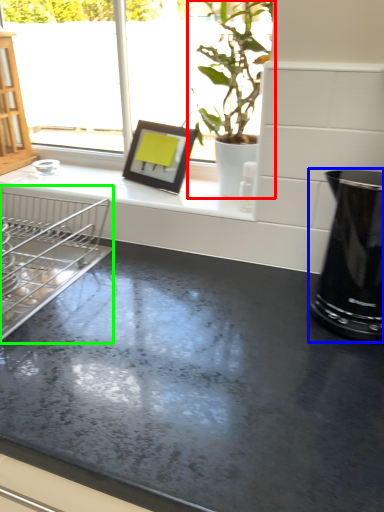
Question: Estimate the real-world distances between objects in this image. Which object is farther from houseplant (highlighted by a red box), appliance (highlighted by a blue box) or dish washer (highlighted by a green box)?

Choices:
 (A) appliance
 (B) dish washer

Answer: (B)